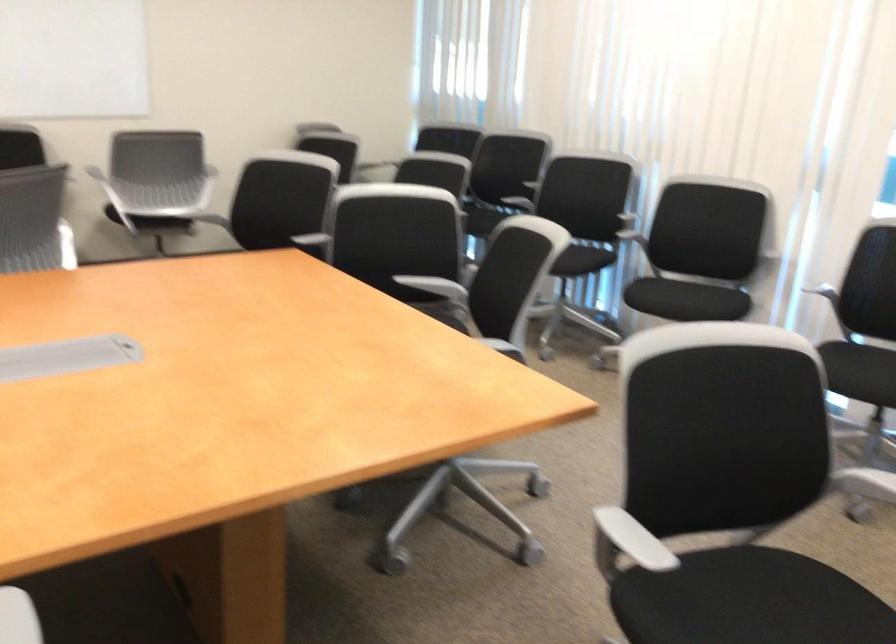
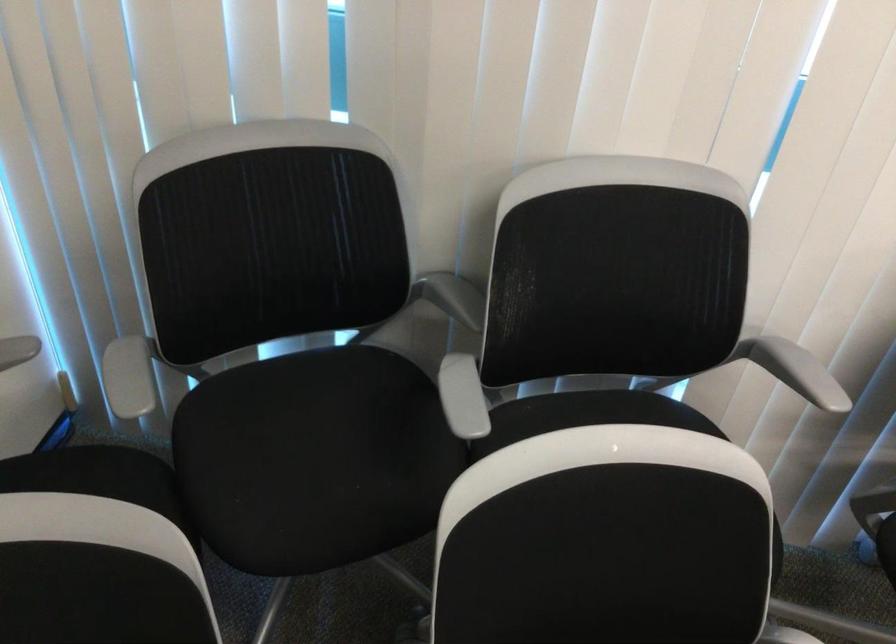
Where in the second image is the point corresponding to pixel 484 158 from the first image?

(453, 297)